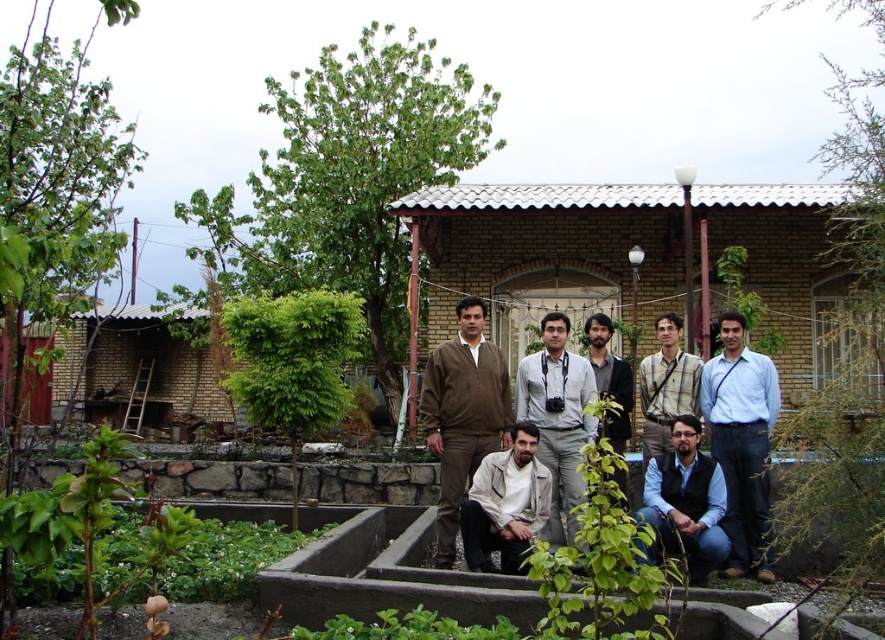
You are a photographer trying to capture a group photo. You notice the light beige fabric shirt at lower center and the dark brown sweater at center. Which person should you ask to move closer to avoid being too wide?

The light beige fabric shirt at lower center is wider than the dark brown sweater at center, so you should ask the person wearing the light beige fabric shirt at lower center to move closer to balance the width.

You are a photographer trying to capture a group photo. You notice the light beige fabric shirt at lower center and the dark brown sweater at center. Which person should you ask to stand on a small stool to ensure both are visible in the photo?

The light beige fabric shirt at lower center is shorter than the dark brown sweater at center, so you should ask the person wearing the light beige fabric shirt at lower center to stand on a small stool to ensure both are visible in the photo.

You are a photographer trying to capture a group photo of the light gray fabric shirt at center and dark brown sweater at center. The camera you are using has a minimum focus distance of 23 inches. Will you be able to focus on both subjects at the same time?

The light gray fabric shirt at center and dark brown sweater at center are 22.91 inches apart from each other. Since the camera requires a minimum focus distance of 23 inches, the photographer cannot focus on both subjects simultaneously as the distance between them is slightly less than the required distance.